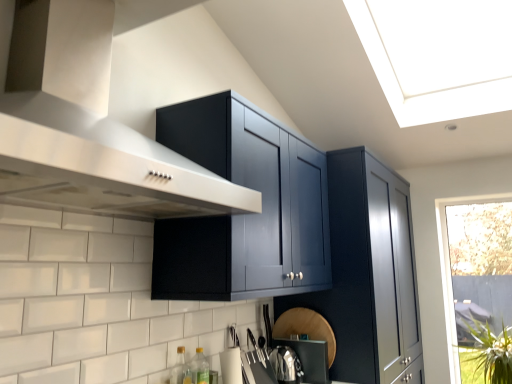
Question: In terms of size, does green glass bottle at lower center, the second bottle positioned from the front, appear bigger or smaller than green leafy plant at lower right?

Choices:
 (A) small
 (B) big

Answer: (A)

Question: From a real-world perspective, is green glass bottle at lower center, the second bottle positioned from the front, above or below green leafy plant at lower right?

Choices:
 (A) below
 (B) above

Answer: (B)

Question: Considering the real-world distances, which object is closest to the glossy dark blue cabinet at upper center?

Choices:
 (A) green glass bottle at lower center, the second bottle positioned from the front
 (B) transparent glass window at right
 (C) satin silver kettle at lower center
 (D) green leafy plant at lower right
 (E) translucent glass bottle at lower left, which appears as the first bottle when viewed from the front

Answer: (C)

Question: Which is farther from the green leafy plant at lower right?

Choices:
 (A) transparent glass window at right
 (B) glossy dark blue cabinet at upper center
 (C) translucent glass bottle at lower left, which appears as the first bottle when viewed from the front
 (D) satin silver kettle at lower center
 (E) green glass bottle at lower center, the second bottle positioned from the front

Answer: (C)